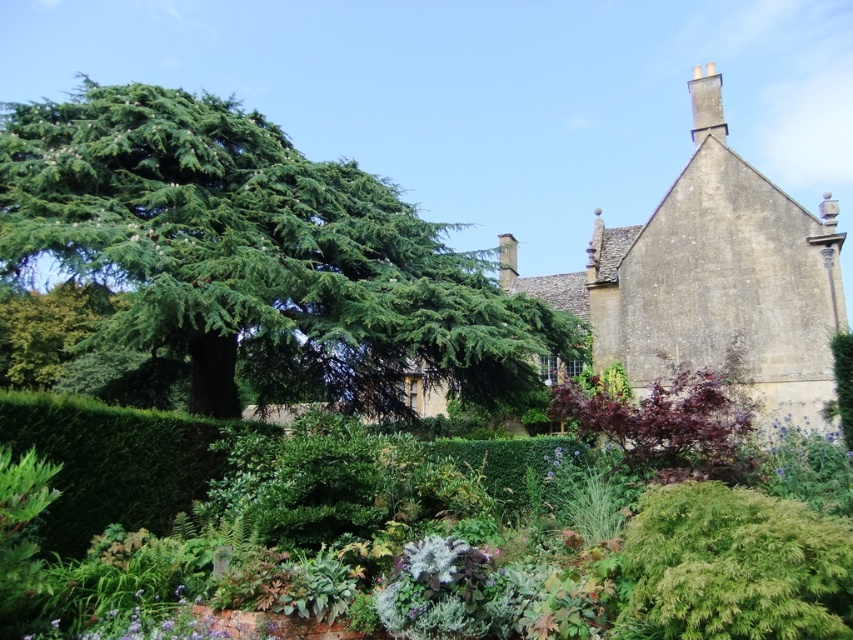
You are standing in the garden of the traditional stone house and want to take a photo of the green leafy tree at upper left. If your camera has a maximum focus range of 50 feet, will you be able to capture the tree clearly without moving closer?

The green leafy tree at upper left is 48.14 feet away from the viewer. Since the camera can focus up to 50 feet, you can capture the tree clearly without moving closer.